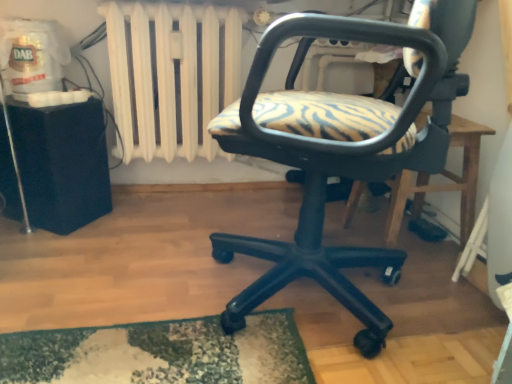
Question: From a real-world perspective, is matte black office chair at center over white painted metal radiator at upper center?

Choices:
 (A) no
 (B) yes

Answer: (A)

Question: Is matte black office chair at center shorter than white painted metal radiator at upper center?

Choices:
 (A) yes
 (B) no

Answer: (B)

Question: From the image's perspective, does matte black office chair at center appear lower than white painted metal radiator at upper center?

Choices:
 (A) no
 (B) yes

Answer: (B)

Question: Is matte black office chair at center wider than white painted metal radiator at upper center?

Choices:
 (A) no
 (B) yes

Answer: (B)

Question: Does matte black office chair at center come behind white painted metal radiator at upper center?

Choices:
 (A) no
 (B) yes

Answer: (A)

Question: Is matte black office chair at center smaller than white painted metal radiator at upper center?

Choices:
 (A) yes
 (B) no

Answer: (B)

Question: Is white painted metal radiator at upper center far away from matte black office chair at center?

Choices:
 (A) no
 (B) yes

Answer: (A)

Question: Does white painted metal radiator at upper center have a smaller size compared to matte black office chair at center?

Choices:
 (A) no
 (B) yes

Answer: (B)

Question: Can you confirm if white painted metal radiator at upper center is bigger than matte black office chair at center?

Choices:
 (A) no
 (B) yes

Answer: (A)

Question: Is white painted metal radiator at upper center oriented away from matte black office chair at center?

Choices:
 (A) no
 (B) yes

Answer: (A)

Question: Is white painted metal radiator at upper center outside matte black office chair at center?

Choices:
 (A) yes
 (B) no

Answer: (A)

Question: From the image's perspective, would you say white painted metal radiator at upper center is shown under matte black office chair at center?

Choices:
 (A) no
 (B) yes

Answer: (A)

Question: Does matte black office chair at center have a larger size compared to wooden table at center, which appears as the first table when viewed from the right?

Choices:
 (A) yes
 (B) no

Answer: (A)